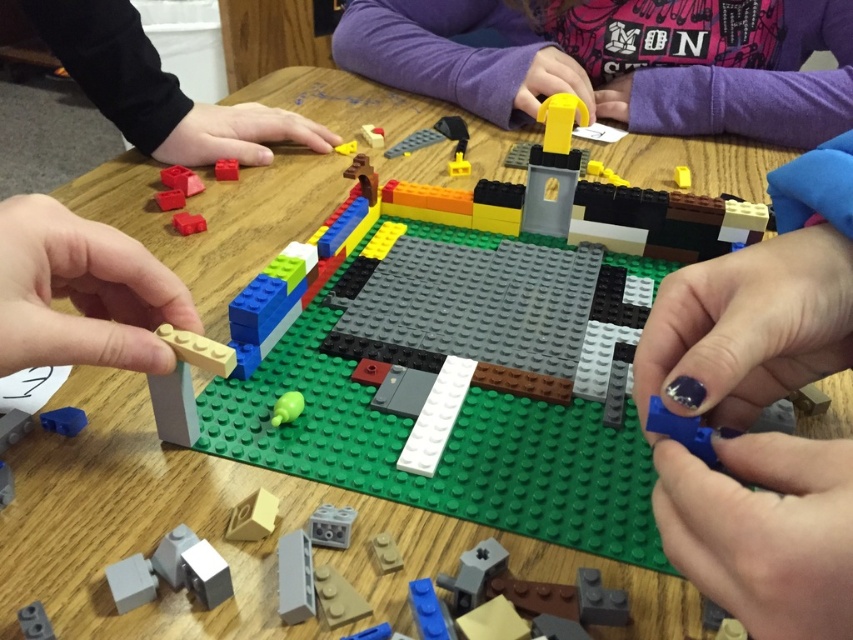
Question: Is blue plastic brick at center above yellow plastic block at center?

Choices:
 (A) no
 (B) yes

Answer: (A)

Question: Where is wooden block at left located in relation to matte red brick at lower left in the image?

Choices:
 (A) below
 (B) above

Answer: (A)

Question: Observing the image, what is the correct spatial positioning of wooden block at lower left in reference to matte yellow plastic toy at center?

Choices:
 (A) right
 (B) left

Answer: (B)

Question: Considering the real-world distances, which object is closest to the gray plastic cube at center?

Choices:
 (A) matte red brick at center
 (B) smooth tan brick at center
 (C) blue plastic brick at center
 (D) green matte toy at center

Answer: (B)

Question: Which is farther from the matte gray bricks at lower left?

Choices:
 (A) wooden block at left
 (B) blue plastic brick at lower left
 (C) yellow plastic brick at center
 (D) blue plastic brick at center

Answer: (C)

Question: Among these objects, which one is nearest to the camera?

Choices:
 (A) wooden block at lower left
 (B) matte black hand at upper left

Answer: (A)